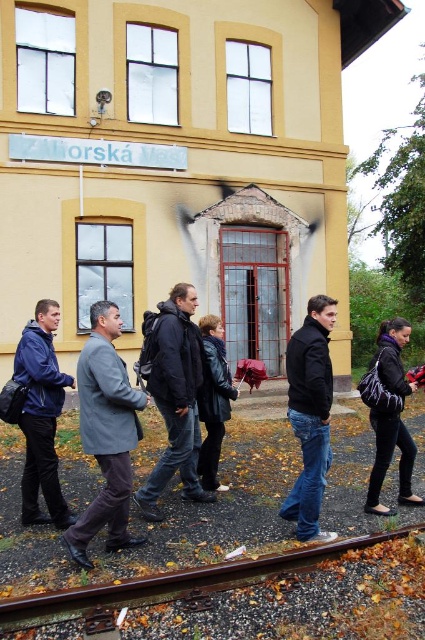
Question: Where is black matte jacket at center located in relation to leather jacket at center in the image?

Choices:
 (A) left
 (B) right

Answer: (B)

Question: Among these objects, which one is farthest from the camera?

Choices:
 (A) dark gray jacket at center
 (B) leather jacket at center
 (C) purple fabric backpack at lower right
 (D) matte blue jacket at lower left

Answer: (B)

Question: Does brown metallic train track at lower center have a lesser width compared to dark gray jacket at center?

Choices:
 (A) no
 (B) yes

Answer: (A)

Question: Can you confirm if dark gray jacket at center is positioned to the right of leather jacket at center?

Choices:
 (A) no
 (B) yes

Answer: (A)

Question: Which is nearer to the matte blue jacket at lower left?

Choices:
 (A) purple fabric backpack at lower right
 (B) dark gray jacket at center

Answer: (B)

Question: Among these objects, which one is farthest from the camera?

Choices:
 (A) leather jacket at center
 (B) purple fabric backpack at lower right

Answer: (A)